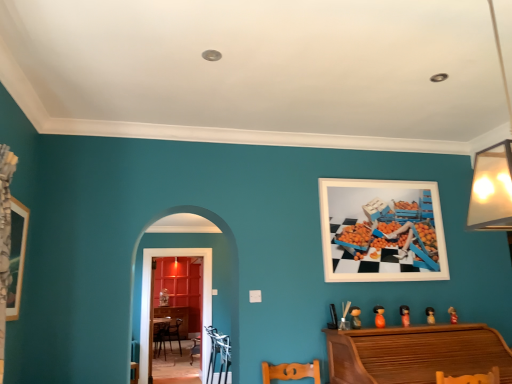
Locate an element on the screen. vacant area that lies in front of orange matte doll at lower right, which is the 3th toy from right to left is located at coordinates (406, 327).